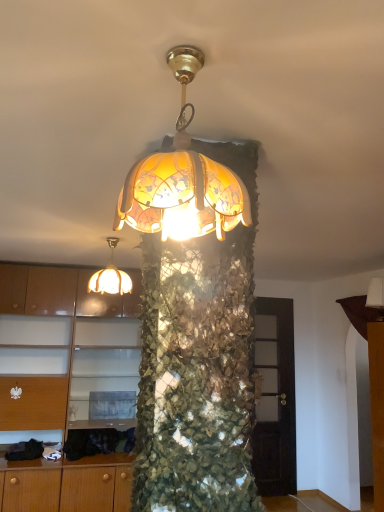
Question: Should I look upward or downward to see translucent glass lampshade at upper center, which is the 3th lamp in right-to-left order?

Choices:
 (A) down
 (B) up

Answer: (A)

Question: From a real-world perspective, is translucent glass lampshade at upper center, which is the 3th lamp in right-to-left order, located higher than matte wood cabinet at left?

Choices:
 (A) no
 (B) yes

Answer: (B)

Question: From the image's perspective, is translucent glass lampshade at upper center, which ranks as the 2th lamp in back-to-front order, under matte wood cabinet at left?

Choices:
 (A) yes
 (B) no

Answer: (B)

Question: Does translucent glass lampshade at upper center, which ranks as the first lamp in left-to-right order, come behind matte wood cabinet at left?

Choices:
 (A) no
 (B) yes

Answer: (A)

Question: Can you confirm if translucent glass lampshade at upper center, which is the 2th lamp in front-to-back order, is wider than matte wood cabinet at left?

Choices:
 (A) yes
 (B) no

Answer: (B)

Question: From a real-world perspective, is translucent glass lampshade at upper center, which ranks as the first lamp in left-to-right order, physically below matte wood cabinet at left?

Choices:
 (A) no
 (B) yes

Answer: (A)

Question: Is translucent glass lampshade at upper center, which is the 3th lamp in right-to-left order, oriented away from matte wood cabinet at left?

Choices:
 (A) yes
 (B) no

Answer: (B)

Question: Can matte wood cabinet at left be found inside translucent glass lampshade at center, which is the first lamp in front-to-back order?

Choices:
 (A) yes
 (B) no

Answer: (B)

Question: Does translucent glass lampshade at center, the third lamp positioned from the back, have a greater width compared to matte wood cabinet at left?

Choices:
 (A) no
 (B) yes

Answer: (A)

Question: Is the position of translucent glass lampshade at center, the second lamp when ordered from right to left, more distant than that of matte wood cabinet at left?

Choices:
 (A) no
 (B) yes

Answer: (A)

Question: From the image's perspective, does translucent glass lampshade at center, which is the first lamp in front-to-back order, appear higher than matte wood cabinet at left?

Choices:
 (A) no
 (B) yes

Answer: (B)

Question: Can you confirm if translucent glass lampshade at center, the 2th lamp in the left-to-right sequence, is smaller than matte wood cabinet at left?

Choices:
 (A) no
 (B) yes

Answer: (B)

Question: Can you confirm if translucent glass lampshade at center, which is the first lamp in front-to-back order, is positioned to the left of matte wood cabinet at left?

Choices:
 (A) yes
 (B) no

Answer: (B)

Question: Is white fabric lampshade at upper right, the 1th lamp positioned from the right, positioned far away from translucent glass lampshade at center, the 2th lamp in the left-to-right sequence?

Choices:
 (A) yes
 (B) no

Answer: (A)